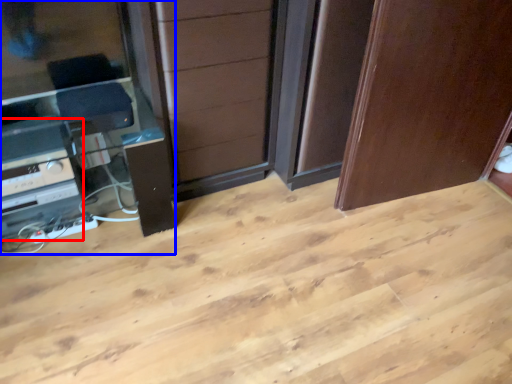
Question: Which point is closer to the camera, appliance (highlighted by a red box) or entertainment center (highlighted by a blue box)?

Choices:
 (A) appliance
 (B) entertainment center

Answer: (B)